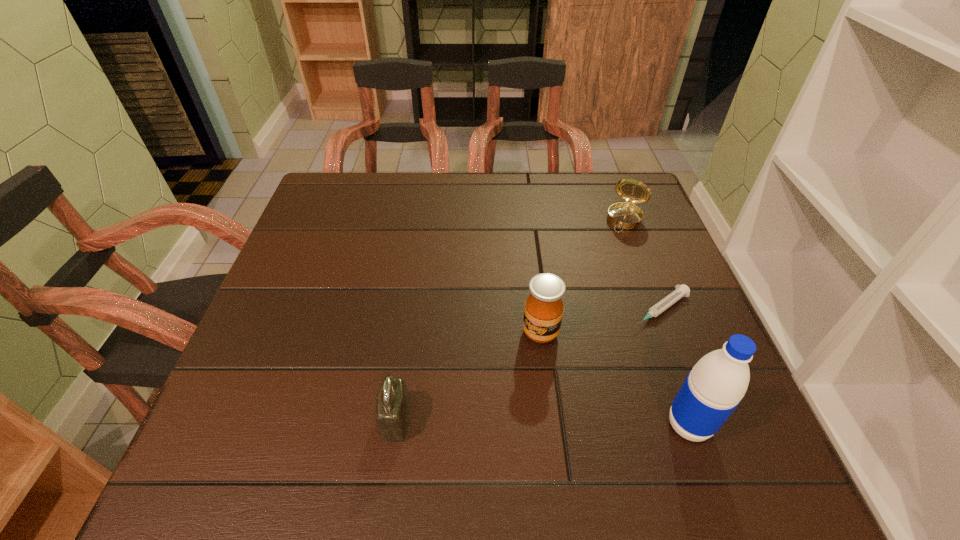
Find the location of `free space on the desktop that is between the padlock and the water bottle and is positioned with the dial facing the compass`. free space on the desktop that is between the padlock and the water bottle and is positioned with the dial facing the compass is located at coordinates pyautogui.click(x=523, y=422).

The image size is (960, 540). I want to click on free space on the desktop that is between the leftmost object and the water bottle and is positioned at the needle end of the syringe, so click(x=509, y=422).

Identify the location of vacant space on the desktop that is between the leftmost object and the tallest object and is positioned on the front-facing side of the second tallest object. click(x=499, y=421).